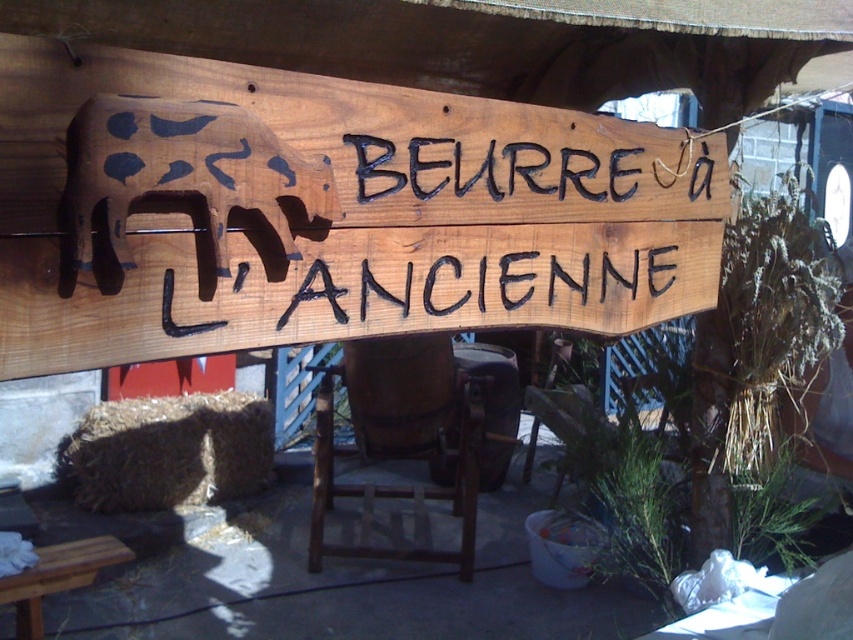
Can you confirm if brown straw bale at lower left is taller than wooden stool at lower left?

Indeed, brown straw bale at lower left has a greater height compared to wooden stool at lower left.

What do you see at coordinates (167, 451) in the screenshot? I see `brown straw bale at lower left` at bounding box center [167, 451].

Locate an element on the screen. This screenshot has height=640, width=853. brown straw bale at lower left is located at coordinates (167, 451).

Can you confirm if brown wooden cow at left is positioned to the left of wooden stool at lower left?

In fact, brown wooden cow at left is to the right of wooden stool at lower left.

Looking at this image, does brown wooden cow at left have a lesser height compared to wooden stool at lower left?

No.

Based on the photo, who is more forward, (293, 228) or (51, 582)?

Point (293, 228)

Locate an element on the screen. brown wooden cow at left is located at coordinates click(x=184, y=186).

Where is `brown wooden cow at left`? This screenshot has width=853, height=640. brown wooden cow at left is located at coordinates (184, 186).

This screenshot has width=853, height=640. What are the coordinates of `brown wooden cow at left` in the screenshot? It's located at (184, 186).

Locate an element on the screen. brown wooden cow at left is located at coordinates point(184,186).